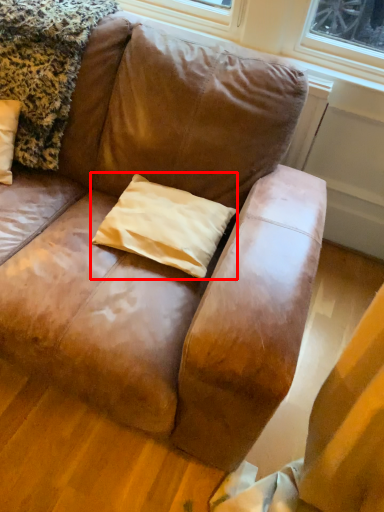
Question: From the image's perspective, considering the relative positions of pillow (annotated by the red box) and blanket in the image provided, where is pillow (annotated by the red box) located with respect to the staircase?

Choices:
 (A) above
 (B) below

Answer: (B)